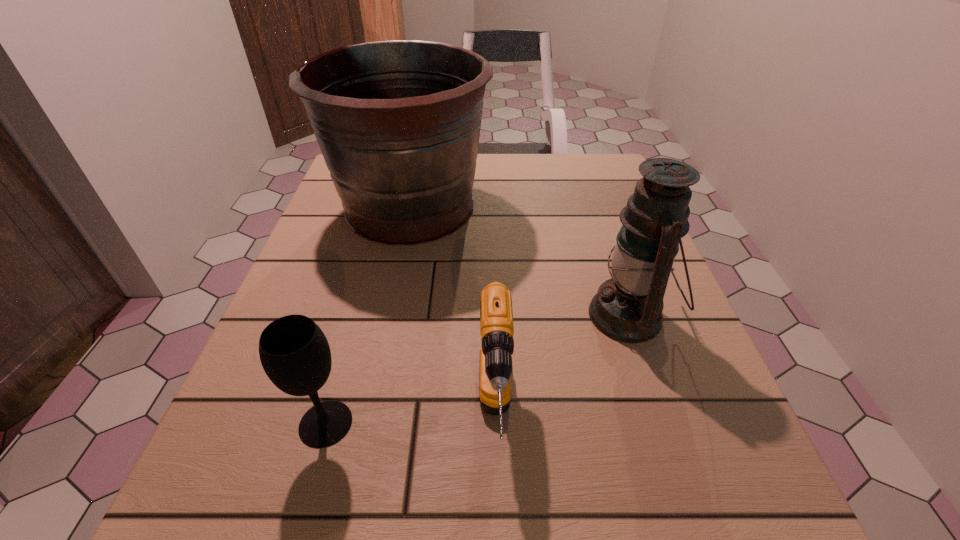
The image size is (960, 540). Find the location of `wineglass located at the left edge`. wineglass located at the left edge is located at coordinates (294, 352).

The image size is (960, 540). Identify the location of object that is at the right edge. (x=628, y=307).

Where is `object situated at the far left corner`? The width and height of the screenshot is (960, 540). object situated at the far left corner is located at coordinates (398, 122).

In the image, there is a desktop. At what (x,y) coordinates should I click in order to perform the action: click on vacant space at the far edge. Please return your answer as a coordinate pair (x, y). The width and height of the screenshot is (960, 540). Looking at the image, I should click on (550, 153).

At what (x,y) coordinates should I click in order to perform the action: click on free location at the near edge. Please return your answer as a coordinate pair (x, y). The height and width of the screenshot is (540, 960). Looking at the image, I should click on (484, 507).

Locate an element on the screen. vacant space at the left edge of the desktop is located at coordinates (316, 272).

I want to click on free region at the right edge of the desktop, so click(x=611, y=340).

Locate an element on the screen. The width and height of the screenshot is (960, 540). vacant space at the far right corner is located at coordinates (578, 188).

Find the location of a particular element. Image resolution: width=960 pixels, height=540 pixels. free spot between the drill and the wineglass is located at coordinates (411, 421).

I want to click on free space between the oil lamp and the wineglass, so click(477, 370).